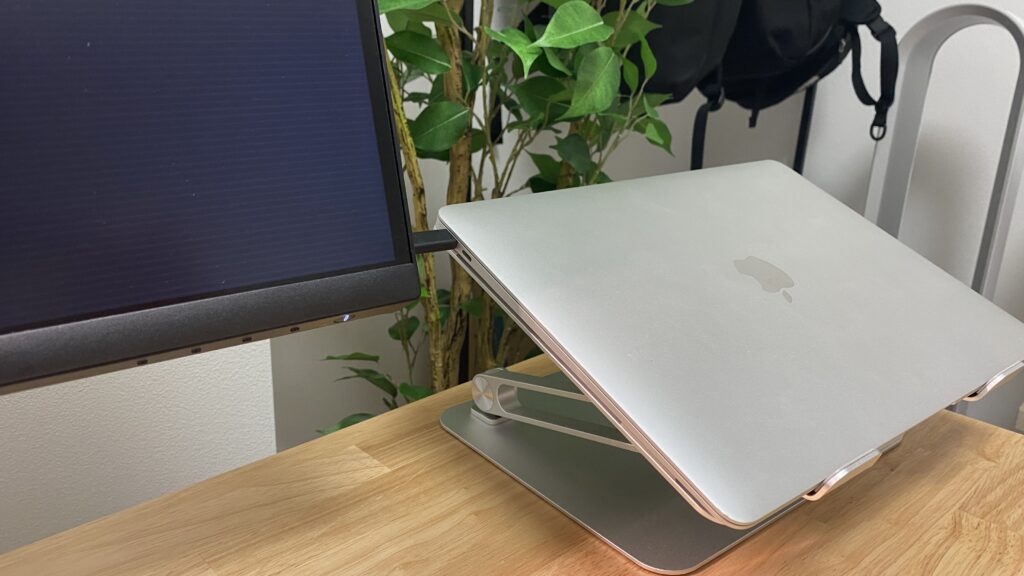
At what (x,y) coordinates should I click in order to perform the action: click on wall. Please return your answer as a coordinate pair (x, y). The height and width of the screenshot is (576, 1024). Looking at the image, I should click on (158, 411).